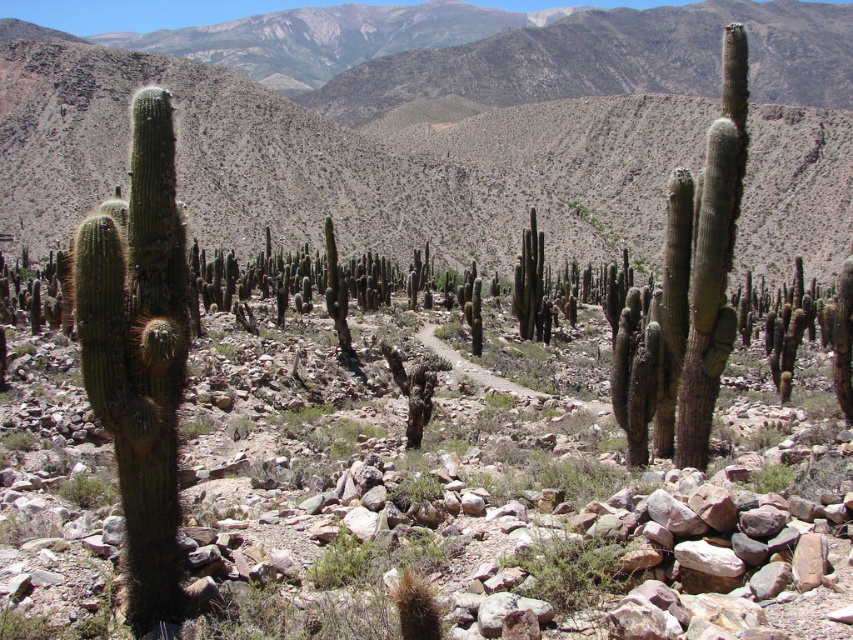
Question: Is green textured mountain range at upper center positioned at the back of green spiny cactus at left?

Choices:
 (A) no
 (B) yes

Answer: (B)

Question: Which object is farther from the camera taking this photo?

Choices:
 (A) green spiny cactus at left
 (B) green textured mountain range at upper center

Answer: (B)

Question: Does green textured mountain range at upper center lie in front of green spiny cactus at left?

Choices:
 (A) yes
 (B) no

Answer: (B)

Question: Does green textured mountain range at upper center have a smaller size compared to green spiny cactus at left?

Choices:
 (A) yes
 (B) no

Answer: (B)

Question: Which point is farther to the camera?

Choices:
 (A) green textured mountain range at upper center
 (B) green spiny cactus at left

Answer: (A)